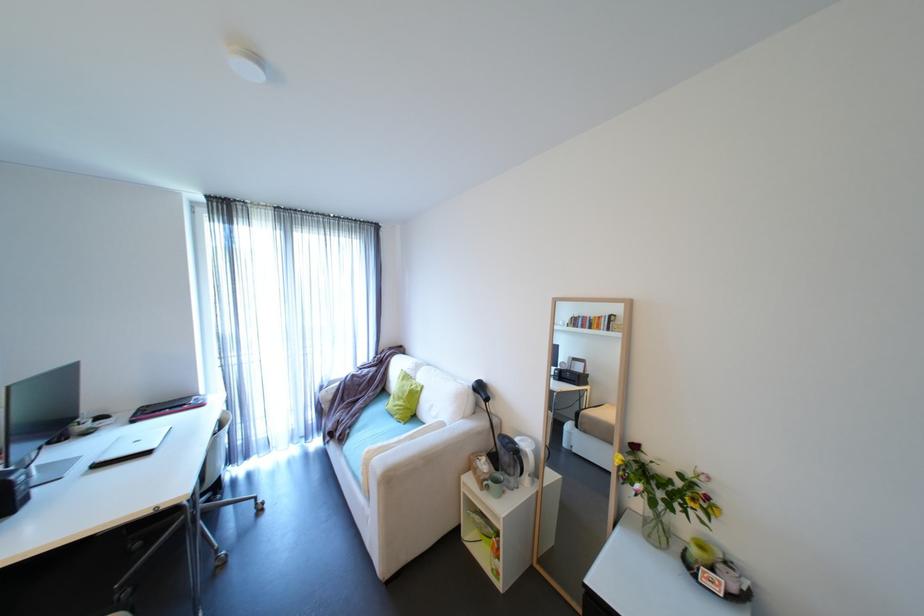
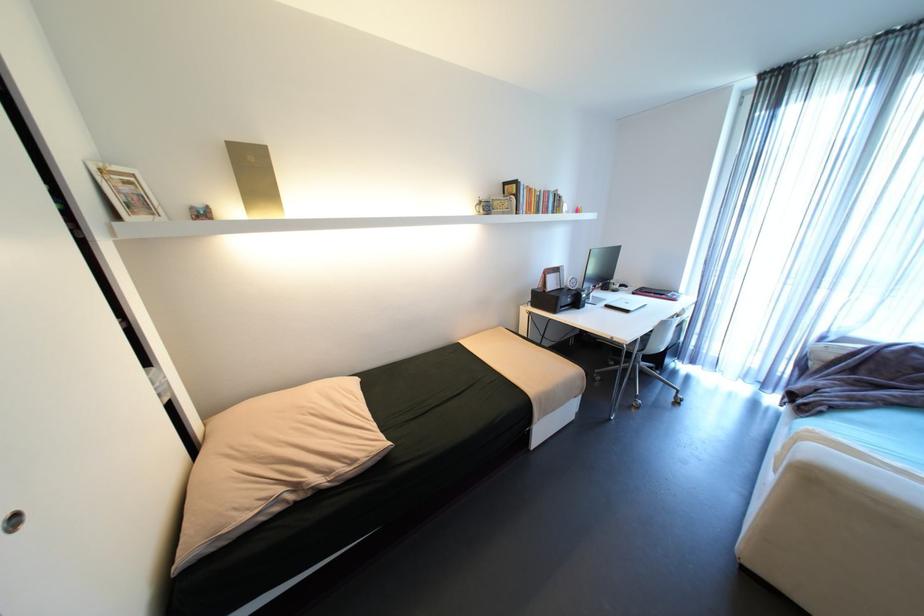
First-person continuous shooting, in which direction is the camera rotating?

The camera rotated toward left-down.